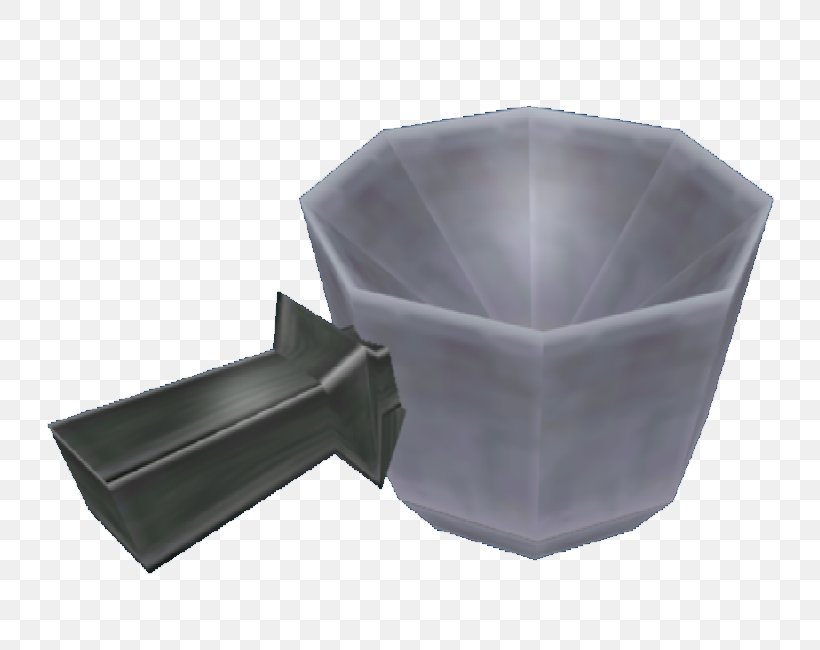
This screenshot has height=650, width=820. I want to click on bowl, so click(x=558, y=291).